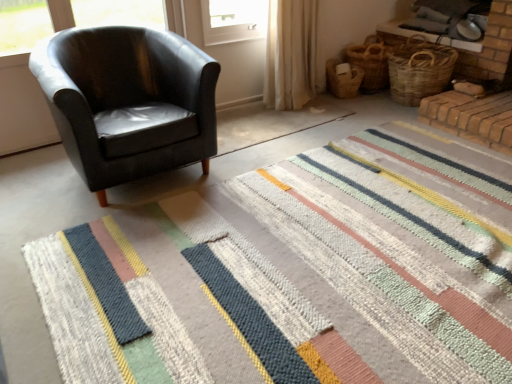
Question: From a real-world perspective, is woven brown basket at upper right, marked as the third basket in a left-to-right arrangement, positioned under matte black armchair at left based on gravity?

Choices:
 (A) yes
 (B) no

Answer: (A)

Question: Is matte black armchair at left at the back of woven brown basket at upper right, marked as the third basket in a left-to-right arrangement?

Choices:
 (A) yes
 (B) no

Answer: (B)

Question: Can you confirm if woven brown basket at upper right, the 1th basket in the right-to-left sequence, is positioned to the left of matte black armchair at left?

Choices:
 (A) yes
 (B) no

Answer: (B)

Question: Considering the relative sizes of woven brown basket at upper right, marked as the third basket in a left-to-right arrangement, and matte black armchair at left in the image provided, is woven brown basket at upper right, marked as the third basket in a left-to-right arrangement, thinner than matte black armchair at left?

Choices:
 (A) no
 (B) yes

Answer: (B)

Question: Can you confirm if woven brown basket at upper right, marked as the third basket in a left-to-right arrangement, is shorter than matte black armchair at left?

Choices:
 (A) yes
 (B) no

Answer: (A)

Question: Is matte black armchair at left located within woven brown basket at upper right, the 1th basket in the right-to-left sequence?

Choices:
 (A) yes
 (B) no

Answer: (B)

Question: Is woven straw basket at right, which is counted as the 1th basket, starting from the left, completely or partially outside of beige fabric curtain at upper center?

Choices:
 (A) yes
 (B) no

Answer: (A)

Question: Could beige fabric curtain at upper center be considered to be inside woven straw basket at right, acting as the third basket starting from the right?

Choices:
 (A) yes
 (B) no

Answer: (B)

Question: Does woven straw basket at right, which is counted as the 1th basket, starting from the left, have a larger size compared to beige fabric curtain at upper center?

Choices:
 (A) yes
 (B) no

Answer: (B)

Question: From the image's perspective, is woven straw basket at right, which is counted as the 1th basket, starting from the left, beneath beige fabric curtain at upper center?

Choices:
 (A) yes
 (B) no

Answer: (A)

Question: Is woven straw basket at right, which is counted as the 1th basket, starting from the left, oriented away from beige fabric curtain at upper center?

Choices:
 (A) no
 (B) yes

Answer: (A)

Question: Is the depth of woven straw basket at right, acting as the third basket starting from the right, greater than that of beige fabric curtain at upper center?

Choices:
 (A) no
 (B) yes

Answer: (B)

Question: From the image's perspective, does woven brown basket at upper right, the 1th basket in the right-to-left sequence, appear lower than beige fabric curtain at upper center?

Choices:
 (A) no
 (B) yes

Answer: (B)